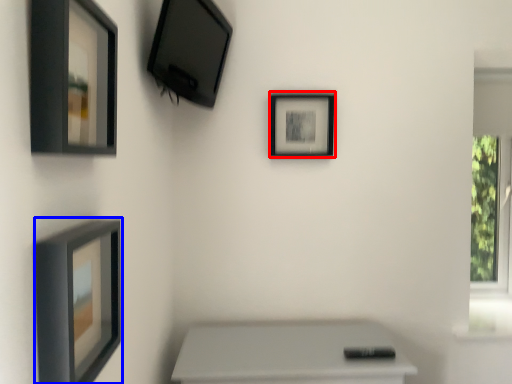
Question: Which object appears farthest to the camera in this image, picture frame (highlighted by a red box) or picture frame (highlighted by a blue box)?

Choices:
 (A) picture frame
 (B) picture frame

Answer: (A)